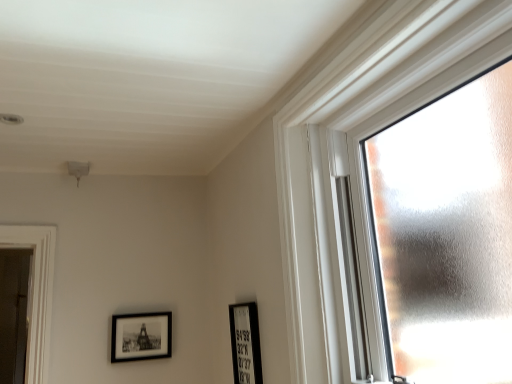
Question: Should I look upward or downward to see black matte picture frame at lower left, which appears as the 2th picture frame when viewed from the front?

Choices:
 (A) down
 (B) up

Answer: (A)

Question: Which direction should I rotate to look at black matte picture frame at lower center, which ranks as the second picture frame in left-to-right order, — up or down?

Choices:
 (A) up
 (B) down

Answer: (B)

Question: Is black matte picture frame at lower center, placed as the 1th picture frame when sorted from front to back, next to black matte picture frame at lower left, marked as the 1th picture frame in a left-to-right arrangement, and touching it?

Choices:
 (A) yes
 (B) no

Answer: (B)

Question: From the image's perspective, is black matte picture frame at lower center, which ranks as the second picture frame in left-to-right order, located above black matte picture frame at lower left, which appears as the 2th picture frame when viewed from the front?

Choices:
 (A) yes
 (B) no

Answer: (A)

Question: Considering the relative positions of black matte picture frame at lower center, the 1th picture frame in the right-to-left sequence, and black matte picture frame at lower left, which ranks as the 2th picture frame in right-to-left order, in the image provided, is black matte picture frame at lower center, the 1th picture frame in the right-to-left sequence, to the left of black matte picture frame at lower left, which ranks as the 2th picture frame in right-to-left order, from the viewer's perspective?

Choices:
 (A) no
 (B) yes

Answer: (A)

Question: Could black matte picture frame at lower left, which ranks as the 2th picture frame in right-to-left order, be considered to be inside black matte picture frame at lower center, the 1th picture frame in the right-to-left sequence?

Choices:
 (A) yes
 (B) no

Answer: (B)

Question: From a real-world perspective, is black matte picture frame at lower center, placed as the 1th picture frame when sorted from front to back, located higher than black matte picture frame at lower left, which ranks as the 2th picture frame in right-to-left order?

Choices:
 (A) yes
 (B) no

Answer: (B)

Question: Does black matte picture frame at lower center, the 1th picture frame in the right-to-left sequence, appear on the right side of black matte picture frame at lower left, acting as the 1th picture frame starting from the back?

Choices:
 (A) yes
 (B) no

Answer: (A)

Question: Can you confirm if frosted glass window at right is wider than black matte picture frame at lower center, which ranks as the second picture frame in left-to-right order?

Choices:
 (A) yes
 (B) no

Answer: (A)

Question: Is frosted glass window at right oriented towards black matte picture frame at lower center, which ranks as the second picture frame in left-to-right order?

Choices:
 (A) yes
 (B) no

Answer: (B)

Question: Can you confirm if frosted glass window at right is bigger than black matte picture frame at lower center, the second picture frame when ordered from back to front?

Choices:
 (A) yes
 (B) no

Answer: (A)

Question: Is frosted glass window at right facing away from black matte picture frame at lower center, which ranks as the second picture frame in left-to-right order?

Choices:
 (A) yes
 (B) no

Answer: (B)

Question: Can you confirm if frosted glass window at right is shorter than black matte picture frame at lower center, which ranks as the second picture frame in left-to-right order?

Choices:
 (A) no
 (B) yes

Answer: (A)

Question: Is frosted glass window at right in front of black matte picture frame at lower center, which ranks as the second picture frame in left-to-right order?

Choices:
 (A) yes
 (B) no

Answer: (A)

Question: Does frosted glass window at right have a greater width compared to black matte picture frame at lower left, marked as the 1th picture frame in a left-to-right arrangement?

Choices:
 (A) yes
 (B) no

Answer: (A)